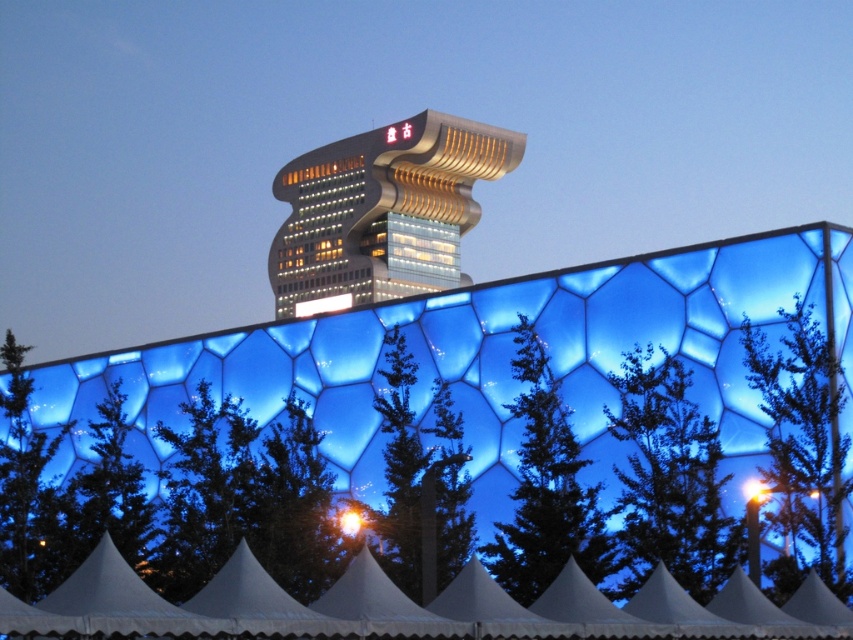
You are standing at the entrance of the Bird Nest in Beijing and want to take a photo of both the bright yellow light at upper center and the matte gold sign at upper center. Given that your camera has a maximum zoom range of 100 meters, can you capture both objects in a single frame without moving?

The bright yellow light at upper center is 139.45 meters from the matte gold sign at upper center. Since the distance exceeds the camera maximum zoom range of 100 meters, you cannot capture both objects in a single frame without moving.

You are an event planner setting up a booth at the Bird Nest in Beijing. You have a white fabric tent at lower center and a matte gold sign at upper center. Which object should you prioritize placing first if you want to ensure visibility from a distance?

The white fabric tent at lower center should be prioritized because it is larger in size than the matte gold sign at upper center, making it more visible from a distance.

You are standing in front of the Bird Nest and want to take a photo of the bright yellow light at upper center and the matte gold sign at upper center. Which object is positioned to the right side of the other?

The bright yellow light at upper center is to the right of the matte gold sign at upper center.